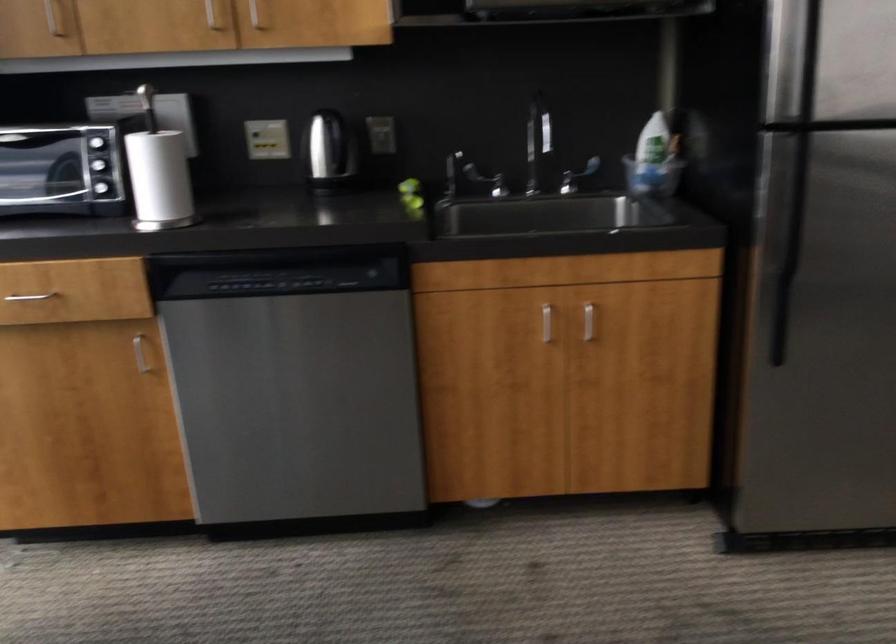
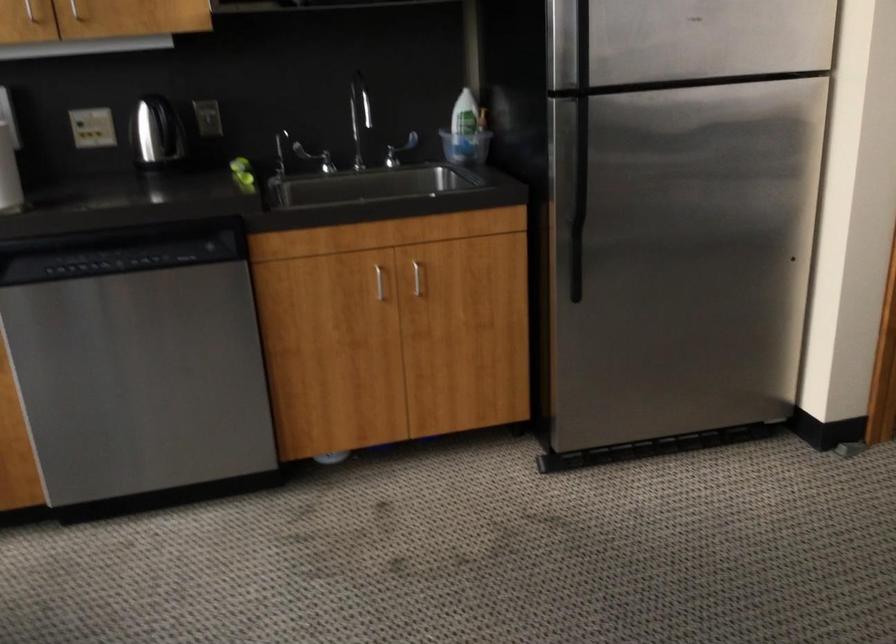
Question: The camera is either moving clockwise (left) or counter-clockwise (right) around the object. The first image is from the beginning of the video and the second image is from the end. Is the camera moving left or right when shooting the video?

Choices:
 (A) Left
 (B) Right

Answer: (A)